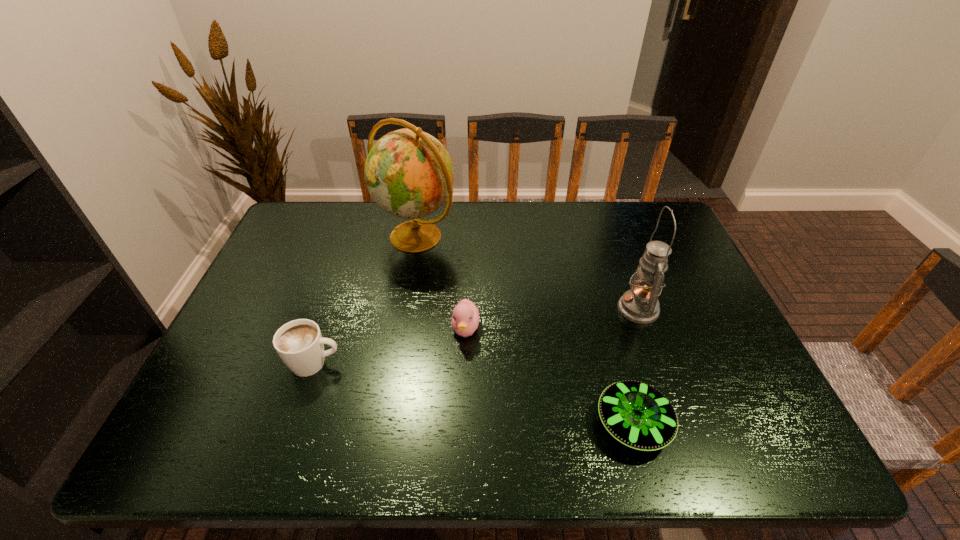
Where is `the farthest object`? The width and height of the screenshot is (960, 540). the farthest object is located at coordinates (409, 174).

Find the location of a particular element. The height and width of the screenshot is (540, 960). globe is located at coordinates (409, 174).

I want to click on the fourth shortest object, so click(640, 304).

This screenshot has width=960, height=540. Identify the location of cappuccino. (299, 343).

This screenshot has width=960, height=540. In order to click on duckling in this screenshot , I will do `click(465, 318)`.

At what (x,y) coordinates should I click in order to perform the action: click on the nearest object. Please return your answer as a coordinate pair (x, y). This screenshot has height=540, width=960. Looking at the image, I should click on (638, 415).

Locate an element on the screen. The height and width of the screenshot is (540, 960). saucer is located at coordinates click(638, 415).

This screenshot has width=960, height=540. Find the location of `vacant region located 0.060m on the left of the globe`. vacant region located 0.060m on the left of the globe is located at coordinates (356, 237).

Locate an element on the screen. vacant space located on the left of the oil lamp is located at coordinates tap(496, 309).

Where is `free region located 0.140m with the handle on the side of the fourth farthest object`? The image size is (960, 540). free region located 0.140m with the handle on the side of the fourth farthest object is located at coordinates (400, 363).